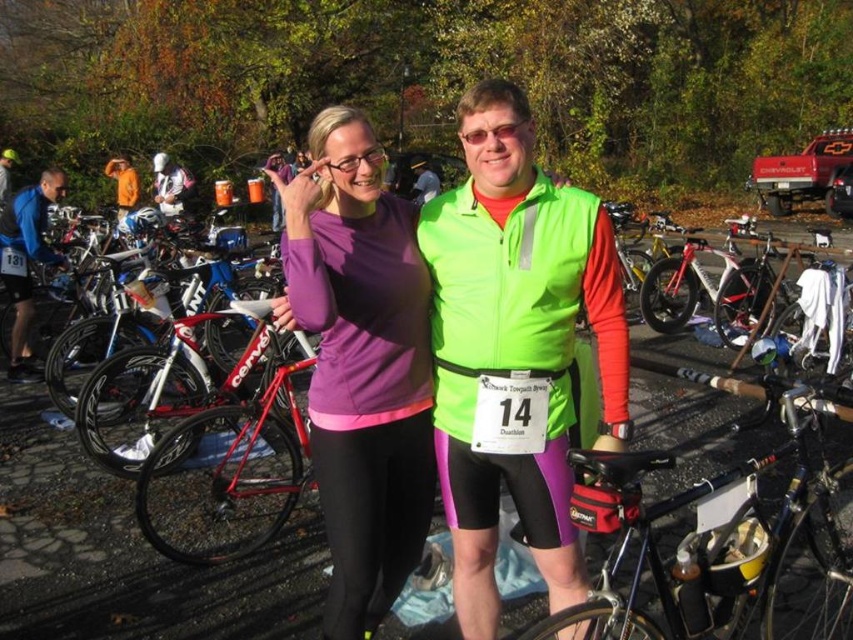
Between shiny black bike at center and purple matte long-sleeve shirt at center, which one is positioned higher?

purple matte long-sleeve shirt at center is above.

Which is in front, point (245, 637) or point (358, 131)?

Point (358, 131) is in front.

At what (x,y) coordinates should I click in order to perform the action: click on shiny black bike at center. Please return your answer as a coordinate pair (x, y). Looking at the image, I should click on (125, 552).

Identify the location of purple matte long-sleeve shirt at center. This screenshot has width=853, height=640. (361, 364).

Does purple matte long-sleeve shirt at center appear on the left side of black matte bicycle at center?

Indeed, purple matte long-sleeve shirt at center is positioned on the left side of black matte bicycle at center.

In the scene shown: Measure the distance between point (297, 195) and camera.

Point (297, 195) and camera are 2.53 meters apart from each other.

Locate an element on the screen. The height and width of the screenshot is (640, 853). purple matte long-sleeve shirt at center is located at coordinates (361, 364).

Who is taller, neon green vest at center or shiny black bike at center?

With more height is neon green vest at center.

Can you confirm if neon green vest at center is positioned above shiny black bike at center?

Yes.

Is point (540, 250) less distant than point (666, 339)?

Yes, point (540, 250) is closer to viewer.

Identify the location of neon green vest at center. (515, 349).